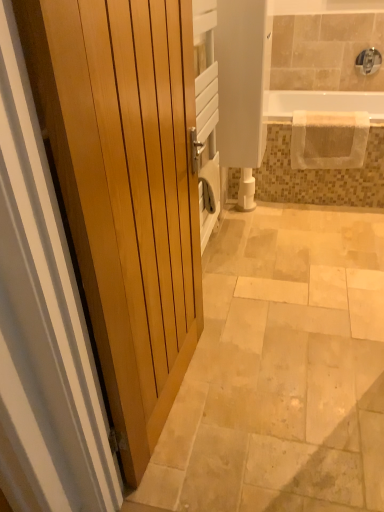
Question: Is white glossy toilet paper at center wider or thinner than beige textured towel at upper right?

Choices:
 (A) wide
 (B) thin

Answer: (B)

Question: From a real-world perspective, is white glossy toilet paper at center above or below beige textured towel at upper right?

Choices:
 (A) below
 (B) above

Answer: (A)

Question: Estimate the real-world distances between objects in this image. Which object is closer to the white glossy toilet paper at center?

Choices:
 (A) light wood door at left
 (B) beige textured towel at upper right
 (C) white textured bathtub at upper right
 (D) silver metallic faucet at upper right

Answer: (B)

Question: Based on their relative distances, which object is farther from the beige textured towel at upper right?

Choices:
 (A) light wood door at left
 (B) white textured bathtub at upper right
 (C) silver metallic faucet at upper right
 (D) white glossy toilet paper at center

Answer: (A)